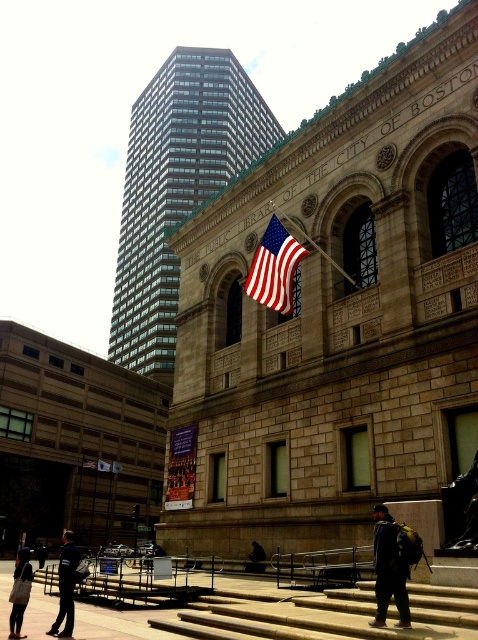
The width and height of the screenshot is (478, 640). I want to click on dark gray sweater at lower left, so click(20, 593).

Which is more to the right, dark gray sweater at lower left or dark blue jacket at lower center?

dark blue jacket at lower center is more to the right.

Locate an element on the screen. The height and width of the screenshot is (640, 478). dark gray sweater at lower left is located at coordinates (20, 593).

Does dark blue jacket at lower right appear under dark blue uniform at lower left?

No, dark blue jacket at lower right is not below dark blue uniform at lower left.

Is dark blue jacket at lower right positioned at the back of dark blue uniform at lower left?

That is False.

Find the location of a particular element. This screenshot has height=640, width=478. dark blue jacket at lower right is located at coordinates (389, 570).

The height and width of the screenshot is (640, 478). Identify the location of dark blue jacket at lower right. (389, 570).

Can you confirm if stone stairs at center is taller than dark gray sweater at lower left?

Incorrect, stone stairs at center's height is not larger of dark gray sweater at lower left's.

Consider the image. Does stone stairs at center appear over dark gray sweater at lower left?

Yes.

You are a GUI agent. You are given a task and a screenshot of the screen. Output one action in this format:
    pyautogui.click(x=<x>, y=<y>)
    Task: Click on the stone stairs at center
    Image resolution: width=478 pixels, height=640 pixels.
    Given the screenshot: What is the action you would take?
    pyautogui.click(x=325, y=614)

Where is `stone stairs at center`? This screenshot has height=640, width=478. stone stairs at center is located at coordinates (325, 614).